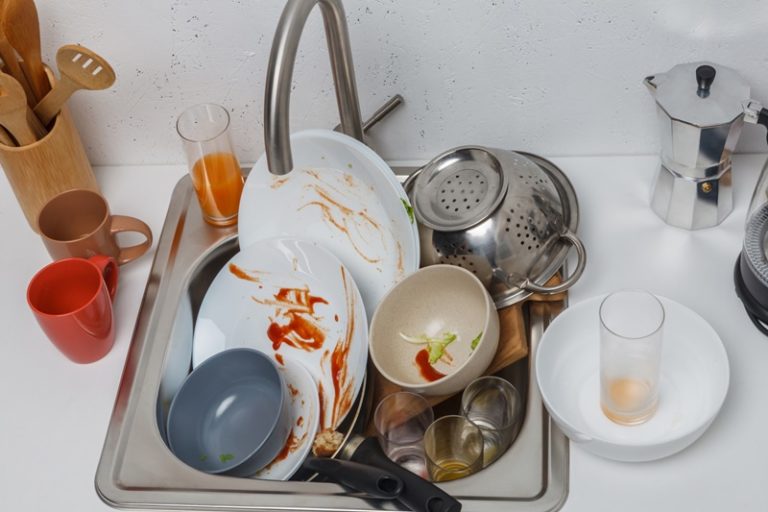
Image resolution: width=768 pixels, height=512 pixels. Identify the location of dirty cups. (502, 397), (459, 444), (409, 422), (630, 361), (200, 142), (96, 214), (70, 292).